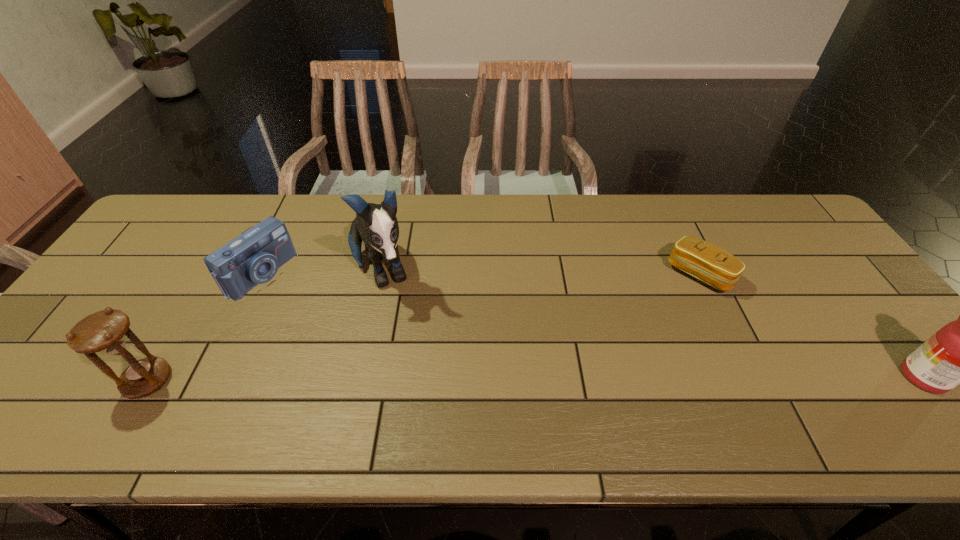
The image size is (960, 540). I want to click on vacant region located 0.060m on the back of the hourglass, so click(171, 340).

Image resolution: width=960 pixels, height=540 pixels. Identify the location of vacant space located on the lens of the second shortest object. (323, 315).

Where is `free space located on the lens of the second shortest object`? The height and width of the screenshot is (540, 960). free space located on the lens of the second shortest object is located at coordinates (333, 321).

Where is `free space located on the lens of the second shortest object`? This screenshot has width=960, height=540. free space located on the lens of the second shortest object is located at coordinates (353, 334).

Identify the location of free spot located 0.340m on the zipper side of the second object from right to left. The height and width of the screenshot is (540, 960). point(607,359).

Where is `blank space located 0.140m on the zipper side of the second object from right to left`? blank space located 0.140m on the zipper side of the second object from right to left is located at coordinates (654, 315).

You are a GUI agent. You are given a task and a screenshot of the screen. Output one action in this format:
    pyautogui.click(x=<x>, y=<y>)
    Task: Click on the vacant space positioned on the zipper side of the second object from right to left
    The width and height of the screenshot is (960, 540).
    Given the screenshot: What is the action you would take?
    pyautogui.click(x=632, y=336)

Image resolution: width=960 pixels, height=540 pixels. I want to click on vacant region located 0.110m on the front-facing side of the third object from right to left, so click(399, 338).

What are the coordinates of `vacant region located on the front-facing side of the third object from right to left` in the screenshot? It's located at click(x=394, y=323).

Locate an element on the screen. The image size is (960, 540). vacant space located on the front-facing side of the third object from right to left is located at coordinates (413, 377).